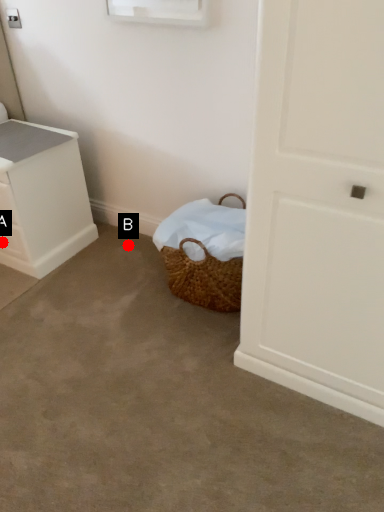
Question: Two points are circled on the image, labeled by A and B beside each circle. Which point appears farthest from the camera in this image?

Choices:
 (A) A is further
 (B) B is further

Answer: (B)